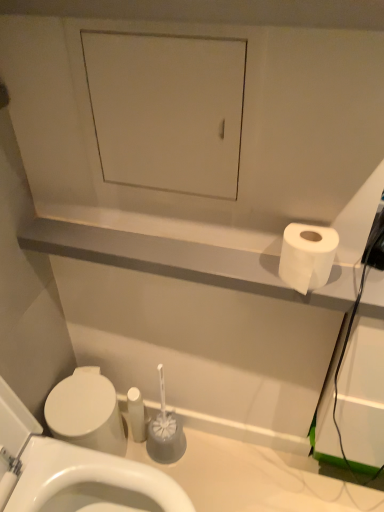
The image size is (384, 512). I want to click on vacant space to the right of white matte toilet paper at right, so click(355, 280).